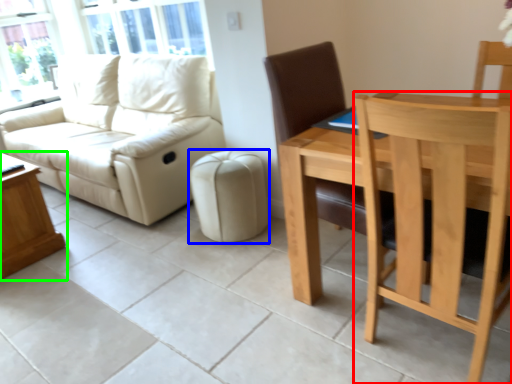
Question: Which is nearer to the chair (highlighted by a red box)? stool (highlighted by a blue box) or table (highlighted by a green box).

Choices:
 (A) stool
 (B) table

Answer: (A)